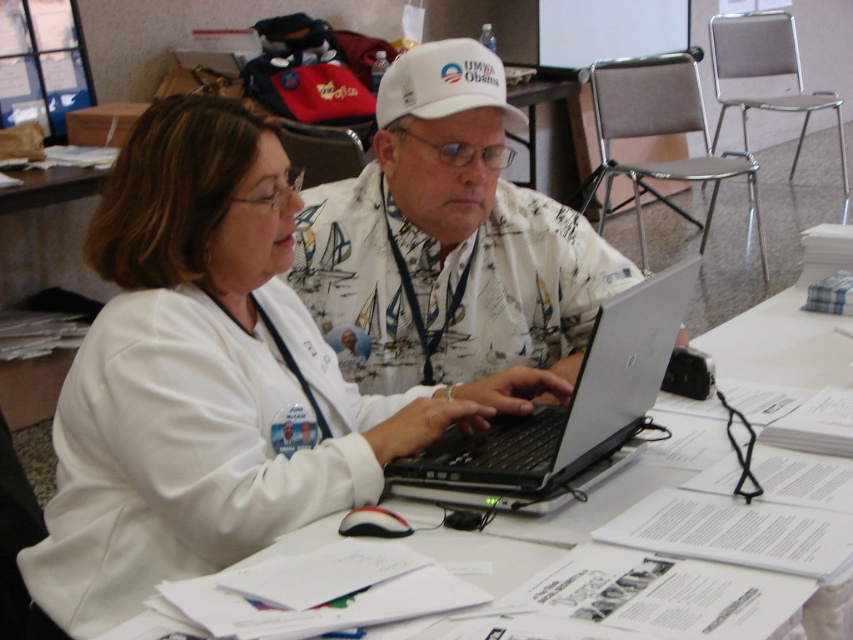
Question: Which object is the closest to the white fabric baseball cap at center?

Choices:
 (A) white fabric shirt at center
 (B) white paper at center

Answer: (A)

Question: Which object is farther from the camera taking this photo?

Choices:
 (A) silver/black keyboard at center
 (B) white fabric baseball cap at center
 (C) white paper at center
 (D) white fabric coat at center

Answer: (B)

Question: Which point appears farthest from the camera in this image?

Choices:
 (A) (498, 481)
 (B) (256, 273)

Answer: (B)

Question: Is white fabric coat at center smaller than silver/black keyboard at center?

Choices:
 (A) yes
 (B) no

Answer: (B)

Question: In this image, where is white fabric coat at center located relative to white fabric shirt at center?

Choices:
 (A) right
 (B) left

Answer: (B)

Question: Is white fabric coat at center smaller than white fabric shirt at center?

Choices:
 (A) yes
 (B) no

Answer: (B)